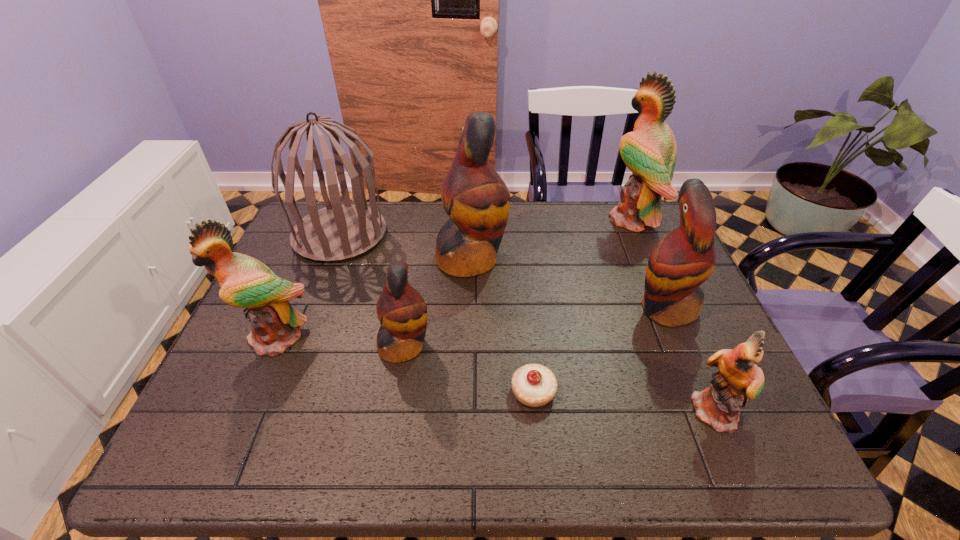
The image size is (960, 540). Identify the location of free space between the leftmost parrot and the smallest red parrot. [341, 342].

The width and height of the screenshot is (960, 540). Identify the location of vacant space in between the farthest red parrot and the rightmost red parrot. (568, 283).

The height and width of the screenshot is (540, 960). What are the coordinates of `empty location between the fifth nearest parrot and the leftmost green parrot` in the screenshot? It's located at (374, 298).

Locate an element on the screen. Image resolution: width=960 pixels, height=540 pixels. empty space between the brown birdcage and the smallest green parrot is located at coordinates (529, 324).

This screenshot has height=540, width=960. I want to click on object that ranks as the third closest to the nearest parrot, so click(x=476, y=199).

Image resolution: width=960 pixels, height=540 pixels. I want to click on object that is the second closest one to the second nearest green parrot, so click(338, 232).

You are a GUI agent. You are given a task and a screenshot of the screen. Output one action in this format:
    pyautogui.click(x=<x>, y=<y>)
    Task: Click on the parrot that stands as the second closest to the nearest green parrot
    This screenshot has width=960, height=540.
    Given the screenshot: What is the action you would take?
    pyautogui.click(x=476, y=199)

Locate an element on the screen. The width and height of the screenshot is (960, 540). parrot that is the closest one to the farthest parrot is located at coordinates (682, 260).

Identify which green parrot is the second closest to the farthest parrot. Please provide its 2D coordinates. Your answer should be formatted as a tuple, i.e. [(x, y)], where the tuple contains the x and y coordinates of a point satisfying the conditions above.

[(245, 282)]

Identify which green parrot is located as the nearest to the farthest red parrot. Please provide its 2D coordinates. Your answer should be formatted as a tuple, i.e. [(x, y)], where the tuple contains the x and y coordinates of a point satisfying the conditions above.

[(245, 282)]